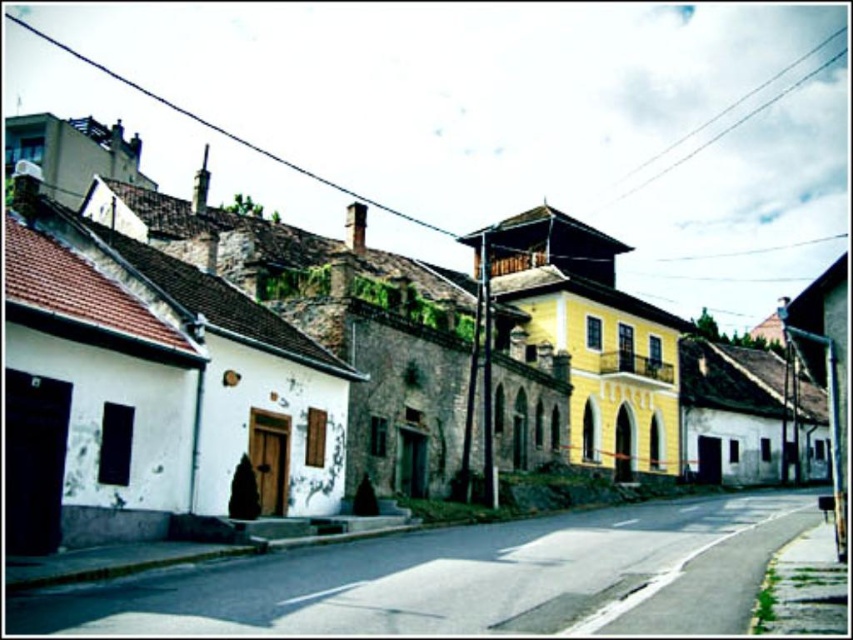
Looking at this image, is white stone building at left wider than metallic pole at right?

Correct, the width of white stone building at left exceeds that of metallic pole at right.

Does point (628, 445) come farther from viewer compared to point (837, 458)?

Yes.

What do you see at coordinates (317, 362) in the screenshot?
I see `white stone building at left` at bounding box center [317, 362].

This screenshot has width=853, height=640. Identify the location of white stone building at left. (317, 362).